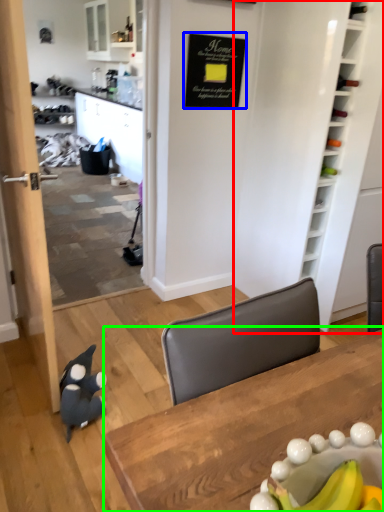
Question: Estimate the real-world distances between objects in this image. Which object is farther from bookshelf (highlighted by a red box), bulletin board (highlighted by a blue box) or table (highlighted by a green box)?

Choices:
 (A) bulletin board
 (B) table

Answer: (B)